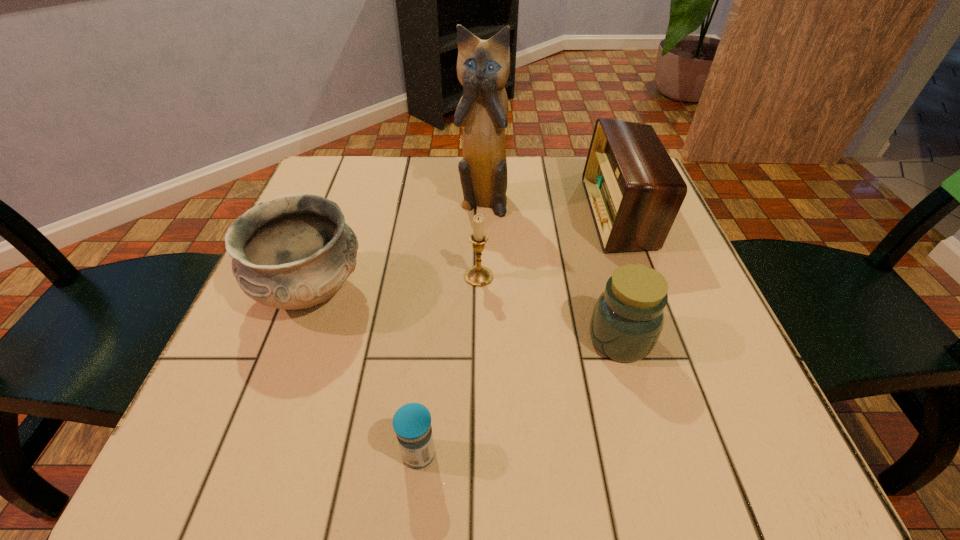
Locate an element on the screen. vacant space located on the front-facing side of the radio receiver is located at coordinates (538, 214).

I want to click on free region located on the front of the pottery, so click(x=265, y=417).

The height and width of the screenshot is (540, 960). What are the coordinates of `free space located on the left of the candle holder` in the screenshot? It's located at (330, 276).

In order to click on vacant space located 0.140m on the left of the jar in this screenshot , I will do `click(506, 339)`.

Where is `vacant space located on the right of the shortest object`? The width and height of the screenshot is (960, 540). vacant space located on the right of the shortest object is located at coordinates (666, 454).

Find the location of `cat that is at the far edge`. cat that is at the far edge is located at coordinates (483, 66).

Where is `radio receiver positioned at the far edge`? Image resolution: width=960 pixels, height=540 pixels. radio receiver positioned at the far edge is located at coordinates pos(634,190).

Where is `object present at the near edge`? object present at the near edge is located at coordinates point(412,422).

Identify the location of object at the left edge. Image resolution: width=960 pixels, height=540 pixels. (295, 251).

Where is `radio receiver present at the right edge`? radio receiver present at the right edge is located at coordinates (634, 190).